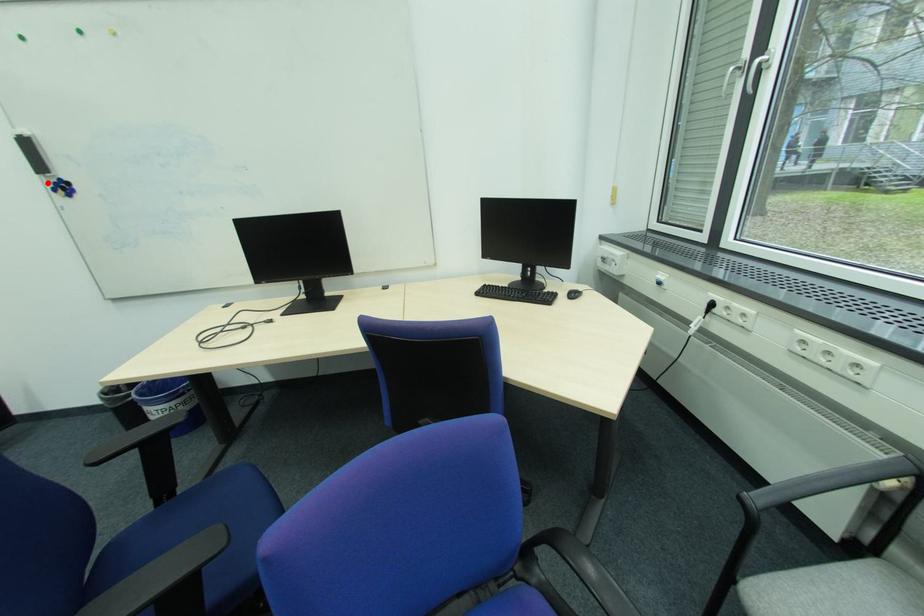
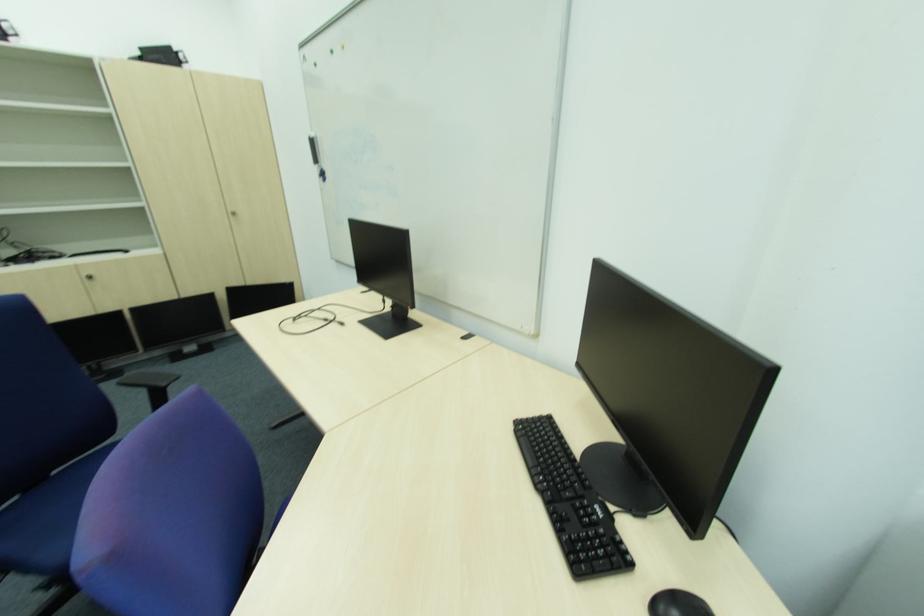
Question: A red point is marked in image1. In image2, is the corresponding 3D point closer to the camera or farther? Reply with the corresponding letter.

Choices:
 (A) The corresponding 3D point is closer.
 (B) The corresponding 3D point is farther.

Answer: (A)